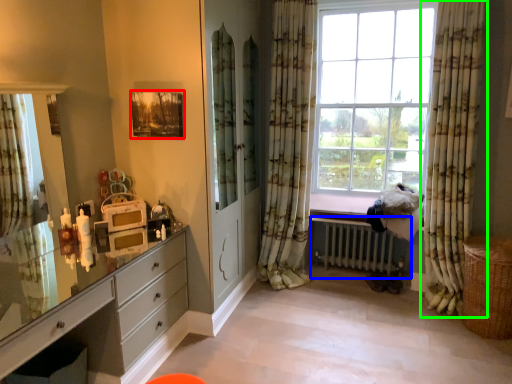
Question: Which object is the closest to the picture frame (highlighted by a red box)? Choose among these: radiator (highlighted by a blue box) or curtain (highlighted by a green box).

Choices:
 (A) radiator
 (B) curtain

Answer: (A)